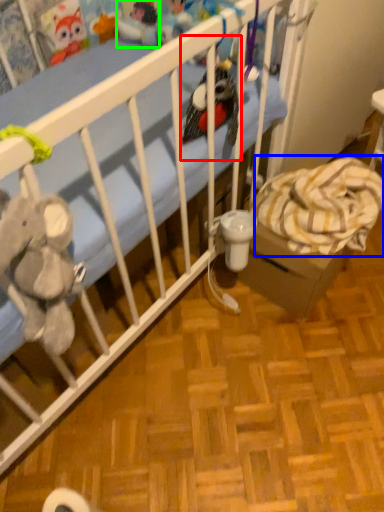
Question: Considering the real-world distances, which object is farthest from toy (highlighted by a red box)? blanket (highlighted by a blue box) or toy (highlighted by a green box)?

Choices:
 (A) blanket
 (B) toy

Answer: (B)